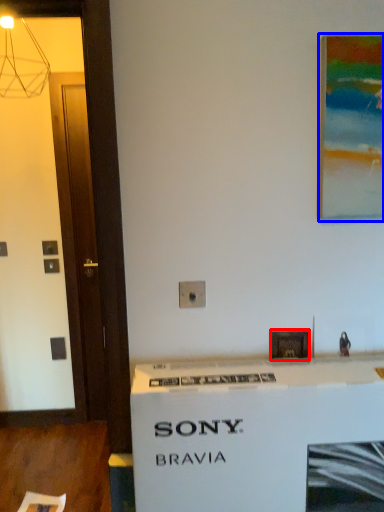
Question: Which object appears farthest to the camera in this image, picture frame (highlighted by a red box) or picture frame (highlighted by a blue box)?

Choices:
 (A) picture frame
 (B) picture frame

Answer: (A)